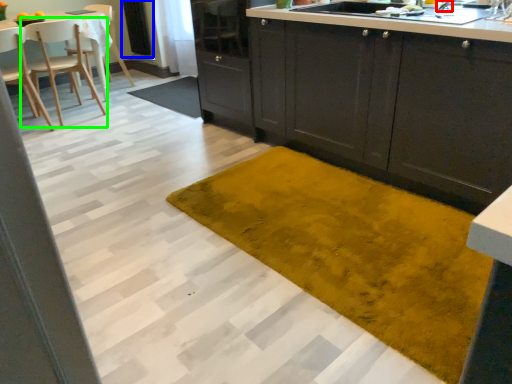
Question: Which is nearer to the faucet (highlighted by a red box)? screen door (highlighted by a blue box) or chair (highlighted by a green box).

Choices:
 (A) screen door
 (B) chair

Answer: (B)